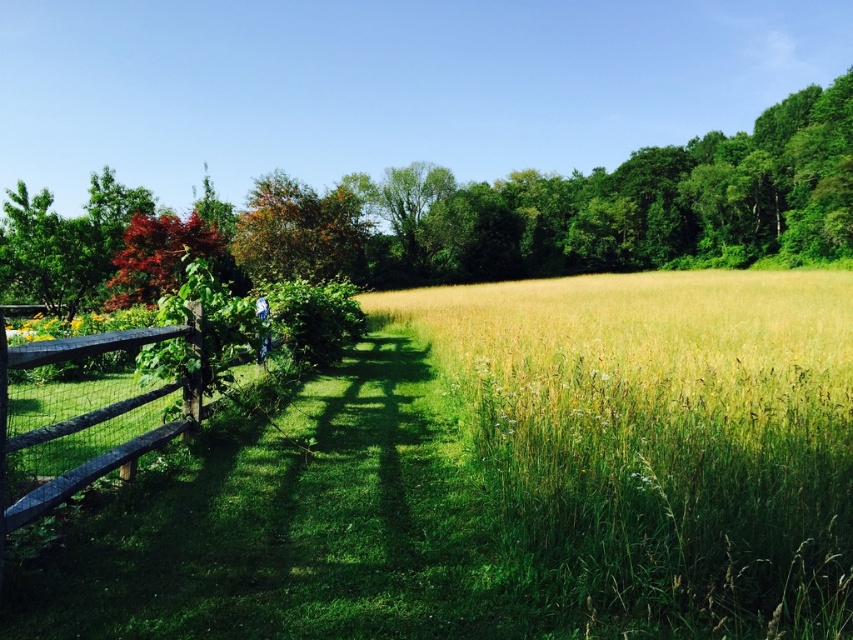
Question: Which of the following is the closest to the observer?

Choices:
 (A) (264, 266)
 (B) (312, 189)
 (C) (163, 260)
 (D) (28, 442)

Answer: (D)

Question: Which point is closer to the camera?

Choices:
 (A) (22, 445)
 (B) (317, 264)

Answer: (A)

Question: Which point is farther to the camera?

Choices:
 (A) (143, 268)
 (B) (79, 465)

Answer: (A)

Question: Can you confirm if brown leafy tree at center is smaller than shiny red maple leaf at upper left?

Choices:
 (A) yes
 (B) no

Answer: (B)

Question: Does brown wooden fence at left appear under shiny red maple leaf at upper left?

Choices:
 (A) no
 (B) yes

Answer: (B)

Question: Is green leafy tree at upper left positioned at the back of brown leafy tree at center?

Choices:
 (A) no
 (B) yes

Answer: (A)